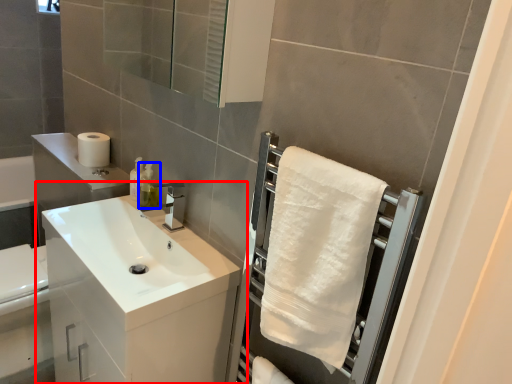
Question: Which object appears farthest to the camera in this image, bathroom cabinet (highlighted by a red box) or soap dispenser (highlighted by a blue box)?

Choices:
 (A) bathroom cabinet
 (B) soap dispenser

Answer: (B)